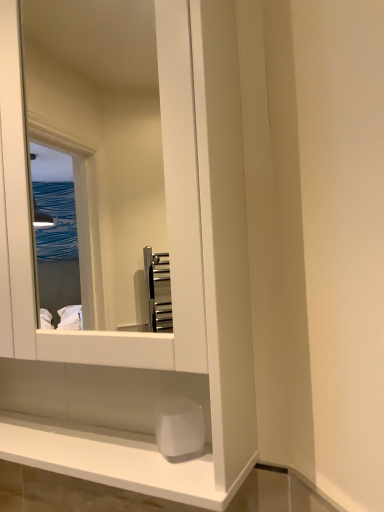
What do you see at coordinates (179, 429) in the screenshot? I see `white matte soap at lower center` at bounding box center [179, 429].

Find the location of a particular element. white matte soap at lower center is located at coordinates click(179, 429).

In order to face white matte soap at lower center, should I rotate leftwards or rightwards?

Turn left approximately 1.731 degrees to face it.

The height and width of the screenshot is (512, 384). What do you see at coordinates (118, 183) in the screenshot?
I see `white glossy mirror at center` at bounding box center [118, 183].

Measure the distance between point (69, 333) and camera.

Point (69, 333) and camera are 28.39 inches apart.

Identify the location of white glossy mirror at center. [x=118, y=183].

This screenshot has height=512, width=384. I want to click on white matte soap at lower center, so (x=179, y=429).

Visually, is white matte soap at lower center positioned to the left or to the right of white glossy mirror at center?

Based on their positions, white matte soap at lower center is located to the right of white glossy mirror at center.

Considering the positions of objects white matte soap at lower center and white glossy mirror at center in the image provided, who is in front, white matte soap at lower center or white glossy mirror at center?

white glossy mirror at center is closer to the camera.

Which point is more forward, (160, 413) or (77, 360)?

The point (77, 360) is closer.

From the image's perspective, which one is positioned higher, white matte soap at lower center or white glossy mirror at center?

white glossy mirror at center, from the image's perspective.

From a real-world perspective, which object stands above the other?

white glossy mirror at center is physically above.

Which object is thinner, white matte soap at lower center or white glossy mirror at center?

white matte soap at lower center is thinner.

From their relative heights in the image, would you say white matte soap at lower center is taller or shorter than white glossy mirror at center?

Clearly, white matte soap at lower center is shorter compared to white glossy mirror at center.

In the scene shown: Considering the sizes of objects white matte soap at lower center and white glossy mirror at center in the image provided, who is bigger, white matte soap at lower center or white glossy mirror at center?

Bigger between the two is white glossy mirror at center.

Is white matte soap at lower center situated inside white glossy mirror at center or outside?

white matte soap at lower center is enclosed within white glossy mirror at center.

Is white matte soap at lower center far away from white glossy mirror at center?

Yes, white matte soap at lower center and white glossy mirror at center are located far from each other.

Is white matte soap at lower center facing towards white glossy mirror at center?

Yes, white matte soap at lower center is facing white glossy mirror at center.

Can you tell me how much white matte soap at lower center and white glossy mirror at center differ in facing direction?

0.002 degrees.

Identify the location of mirror on the left side of white matte soap at lower center. This screenshot has width=384, height=512. (118, 183).

Between white glossy mirror at center and white matte soap at lower center, which one appears on the right side from the viewer's perspective?

Positioned to the right is white matte soap at lower center.

Which object is closer to the camera taking this photo, white glossy mirror at center or white matte soap at lower center?

white glossy mirror at center.

Which is less distant, [62,343] or [169,420]?

Point [62,343] appears to be farther away from the viewer than point [169,420].

From the image's perspective, does white glossy mirror at center appear higher than white matte soap at lower center?

Indeed, from the image's perspective, white glossy mirror at center is shown above white matte soap at lower center.

From a real-world perspective, is white glossy mirror at center physically above white matte soap at lower center?

Yes, from a real-world perspective, white glossy mirror at center is on top of white matte soap at lower center.

Is white glossy mirror at center wider or thinner than white matte soap at lower center?

white glossy mirror at center is wider than white matte soap at lower center.

Can you confirm if white glossy mirror at center is taller than white matte soap at lower center?

Yes, white glossy mirror at center is taller than white matte soap at lower center.

Considering the sizes of white glossy mirror at center and white matte soap at lower center in the image, is white glossy mirror at center bigger or smaller than white matte soap at lower center?

white glossy mirror at center is bigger than white matte soap at lower center.

Which is correct: white glossy mirror at center is inside white matte soap at lower center, or outside of it?

white glossy mirror at center cannot be found inside white matte soap at lower center.

From the picture: Does white glossy mirror at center touch white matte soap at lower center?

No.

Could you tell me if white glossy mirror at center is turned towards white matte soap at lower center?

No, white glossy mirror at center is not oriented towards white matte soap at lower center.

Locate an element on the screen. The image size is (384, 512). mirror lying above the white matte soap at lower center (from the image's perspective) is located at coordinates (118, 183).

Find the location of `soap on the right of white glossy mirror at center`. soap on the right of white glossy mirror at center is located at coordinates (179, 429).

You are a GUI agent. You are given a task and a screenshot of the screen. Output one action in this format:
    pyautogui.click(x=<x>, y=<y>)
    Task: Click on the soap below the white glossy mirror at center (from the image's perspective)
    This screenshot has width=384, height=512.
    Given the screenshot: What is the action you would take?
    pyautogui.click(x=179, y=429)